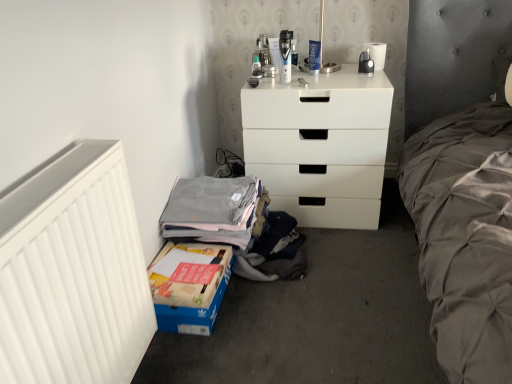
The height and width of the screenshot is (384, 512). What do you see at coordinates (285, 55) in the screenshot?
I see `matte plastic shaver at upper center` at bounding box center [285, 55].

Describe the element at coordinates (189, 286) in the screenshot. I see `blue cardboard box at lower left` at that location.

Locate an element on the screen. This screenshot has height=384, width=512. matte plastic shaver at upper center is located at coordinates (285, 55).

Looking at this image, which of these two, white matte chest of drawers at center or blue cardboard box at lower left, stands taller?

Standing taller between the two is white matte chest of drawers at center.

Is white matte chest of drawers at center bigger or smaller than blue cardboard box at lower left?

Clearly, white matte chest of drawers at center is larger in size than blue cardboard box at lower left.

Locate an element on the screen. The width and height of the screenshot is (512, 384). box below the white matte chest of drawers at center (from the image's perspective) is located at coordinates (189, 286).

Is white matte chest of drawers at center oriented towards blue cardboard box at lower left?

Yes, white matte chest of drawers at center is facing blue cardboard box at lower left.

Based on their positions, is gray cotton shirt at lower left located to the left or right of white matte radiator at left?

In the image, gray cotton shirt at lower left appears on the right side of white matte radiator at left.

Which of these two, gray cotton shirt at lower left or white matte radiator at left, is bigger?

white matte radiator at left.

From a real-world perspective, between gray cotton shirt at lower left and white matte radiator at left, who is vertically lower?

gray cotton shirt at lower left, from a real-world perspective.

Between gray cotton shirt at lower left and white matte radiator at left, which one has larger width?

gray cotton shirt at lower left.

Is there a large distance between white matte radiator at left and gray cotton shirt at lower left?

No, white matte radiator at left is not far away from gray cotton shirt at lower left.

From a real-world perspective, who is located lower, white matte radiator at left or gray cotton shirt at lower left?

gray cotton shirt at lower left.

Which of these two, white matte radiator at left or gray cotton shirt at lower left, is smaller?

gray cotton shirt at lower left is smaller.

Relative to gray cotton shirt at lower left, is white matte radiator at left in front or behind?

white matte radiator at left is in front of gray cotton shirt at lower left.

Can you tell me how much blue cardboard box at lower left and matte plastic shaver at upper center differ in facing direction?

blue cardboard box at lower left and matte plastic shaver at upper center are facing 88 degrees away from each other.

Between blue cardboard box at lower left and matte plastic shaver at upper center, which one has larger size?

Bigger between the two is blue cardboard box at lower left.

From the image's perspective, between blue cardboard box at lower left and matte plastic shaver at upper center, who is located below?

blue cardboard box at lower left appears lower in the image.

Are blue cardboard box at lower left and matte plastic shaver at upper center far apart?

blue cardboard box at lower left is actually quite close to matte plastic shaver at upper center.

Considering the positions of objects matte plastic shaver at upper center and white matte chest of drawers at center in the image provided, who is more to the left, matte plastic shaver at upper center or white matte chest of drawers at center?

Positioned to the left is matte plastic shaver at upper center.

Image resolution: width=512 pixels, height=384 pixels. Find the location of `chest of drawers located on the right of matte plastic shaver at upper center`. chest of drawers located on the right of matte plastic shaver at upper center is located at coordinates (320, 146).

Is point (287, 61) less distant than point (315, 96)?

No, (287, 61) is further to viewer.

Is matte plastic shaver at upper center wider than white matte chest of drawers at center?

In fact, matte plastic shaver at upper center might be narrower than white matte chest of drawers at center.

In terms of size, does white matte radiator at left appear bigger or smaller than blue cardboard box at lower left?

In the image, white matte radiator at left appears to be larger than blue cardboard box at lower left.

Considering the relative positions of white matte radiator at left and blue cardboard box at lower left in the image provided, is white matte radiator at left to the left of blue cardboard box at lower left from the viewer's perspective?

Yes.

The image size is (512, 384). In order to click on radiator above the blue cardboard box at lower left (from the image's perspective) in this screenshot , I will do `click(73, 273)`.

Which of these two, white matte radiator at left or blue cardboard box at lower left, stands shorter?

blue cardboard box at lower left is shorter.

From the image's perspective, does white matte chest of drawers at center appear lower than matte plastic shaver at upper center?

Indeed, from the image's perspective, white matte chest of drawers at center is shown beneath matte plastic shaver at upper center.

Based on the photo, is white matte chest of drawers at center in front of or behind matte plastic shaver at upper center in the image?

Visually, white matte chest of drawers at center is located in front of matte plastic shaver at upper center.

From a real-world perspective, between white matte chest of drawers at center and matte plastic shaver at upper center, who is vertically higher?

matte plastic shaver at upper center, from a real-world perspective.

Find the location of `chest of drawers that appears on the right of blue cardboard box at lower left`. chest of drawers that appears on the right of blue cardboard box at lower left is located at coordinates (320, 146).

Locate an element on the screen. clothing above the white matte radiator at left (from the image's perspective) is located at coordinates (212, 210).

When comparing their distances from white matte chest of drawers at center, does blue cardboard box at lower left or white matte radiator at left seem closer?

blue cardboard box at lower left is closer to white matte chest of drawers at center.

From the image, which object appears to be farther from gray cotton shirt at lower left, white matte chest of drawers at center or blue cardboard box at lower left?

The object further to gray cotton shirt at lower left is white matte chest of drawers at center.

Looking at the image, which one is located further to blue cardboard box at lower left, gray cotton shirt at lower left or matte plastic shaver at upper center?

Among the two, matte plastic shaver at upper center is located further to blue cardboard box at lower left.

From the image, which object appears to be farther from blue cardboard box at lower left, matte plastic shaver at upper center or gray cotton shirt at lower left?

matte plastic shaver at upper center is positioned further to the anchor blue cardboard box at lower left.

When comparing their distances from white matte radiator at left, does matte plastic shaver at upper center or white matte chest of drawers at center seem closer?

white matte chest of drawers at center is closer to white matte radiator at left.

Looking at this image, looking at the image, which one is located closer to blue cardboard box at lower left, white matte radiator at left or matte plastic shaver at upper center?

white matte radiator at left is closer to blue cardboard box at lower left.

Looking at the image, which one is located further to white matte chest of drawers at center, matte plastic shaver at upper center or white matte radiator at left?

white matte radiator at left is further to white matte chest of drawers at center.

Estimate the real-world distances between objects in this image. Which object is further from white matte chest of drawers at center, blue cardboard box at lower left or gray cotton shirt at lower left?

Based on the image, blue cardboard box at lower left appears to be further to white matte chest of drawers at center.

Locate an element on the screen. clothing positioned between white matte radiator at left and matte plastic shaver at upper center from near to far is located at coordinates (212, 210).

Where is `box located between white matte radiator at left and gray cotton shirt at lower left in the depth direction`? box located between white matte radiator at left and gray cotton shirt at lower left in the depth direction is located at coordinates (189, 286).

Where is `chest of drawers between matte plastic shaver at upper center and blue cardboard box at lower left in the up-down direction`? The width and height of the screenshot is (512, 384). chest of drawers between matte plastic shaver at upper center and blue cardboard box at lower left in the up-down direction is located at coordinates (320, 146).

Where is `the chest of drawers located between white matte radiator at left and matte plastic shaver at upper center in the depth direction`? The width and height of the screenshot is (512, 384). the chest of drawers located between white matte radiator at left and matte plastic shaver at upper center in the depth direction is located at coordinates (320, 146).